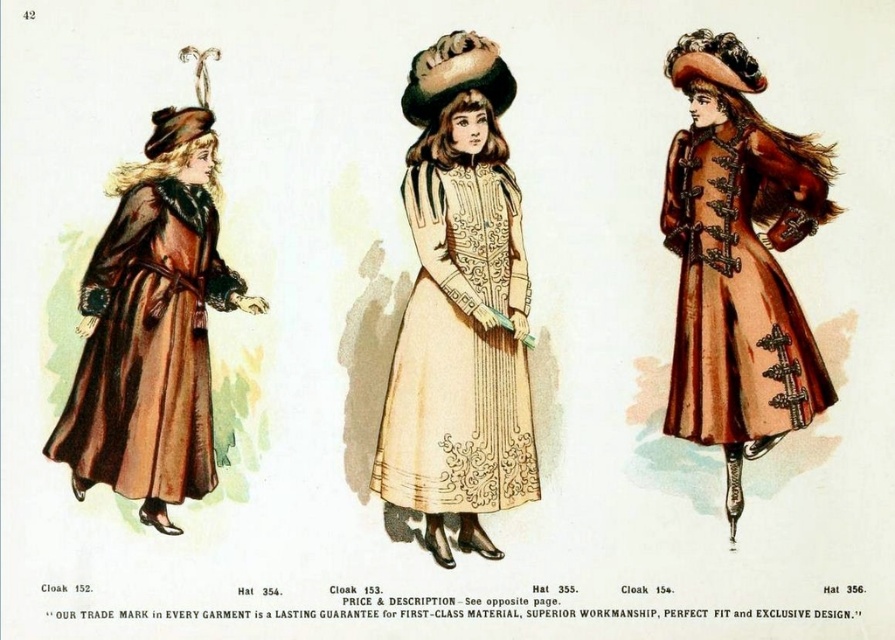
Is matte brown coat at center taller than brown fur coat at left?

Yes, matte brown coat at center is taller than brown fur coat at left.

Who is positioned more to the right, matte brown coat at center or brown fur coat at left?

From the viewer's perspective, matte brown coat at center appears more on the right side.

Image resolution: width=895 pixels, height=640 pixels. Describe the element at coordinates (738, 260) in the screenshot. I see `matte brown coat at center` at that location.

The height and width of the screenshot is (640, 895). Identify the location of matte brown coat at center. (738, 260).

Does beige embroidered dress at center have a lesser height compared to brown fur coat at left?

Incorrect, beige embroidered dress at center's height does not fall short of brown fur coat at left's.

Can you confirm if beige embroidered dress at center is taller than brown fur coat at left?

Correct, beige embroidered dress at center is much taller as brown fur coat at left.

This screenshot has width=895, height=640. I want to click on beige embroidered dress at center, so click(459, 352).

What are the coordinates of `beige embroidered dress at center` in the screenshot? It's located at (459, 352).

Consider the image. Which is below, matte brown coat at center or beige embroidered dress at center?

beige embroidered dress at center is below.

Does matte brown coat at center have a lesser height compared to beige embroidered dress at center?

No.

This screenshot has height=640, width=895. I want to click on matte brown coat at center, so click(738, 260).